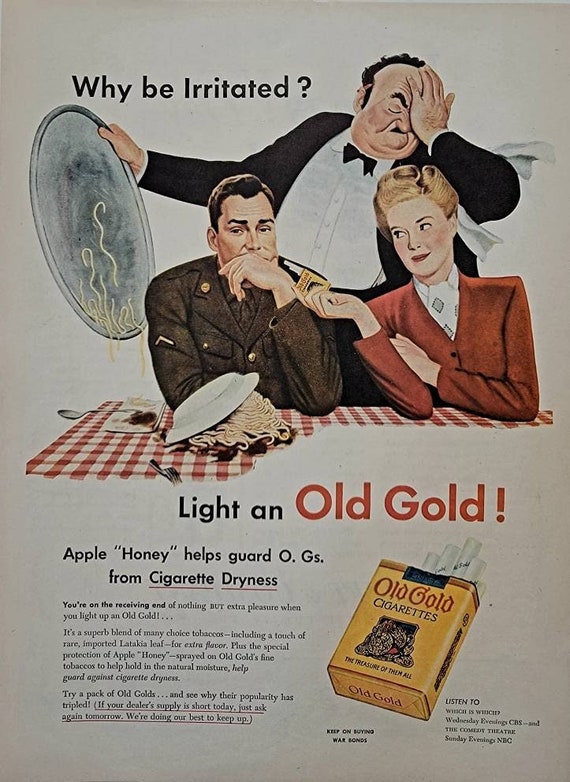
I want to click on spoon beneath the empty tray, so [x=68, y=411].